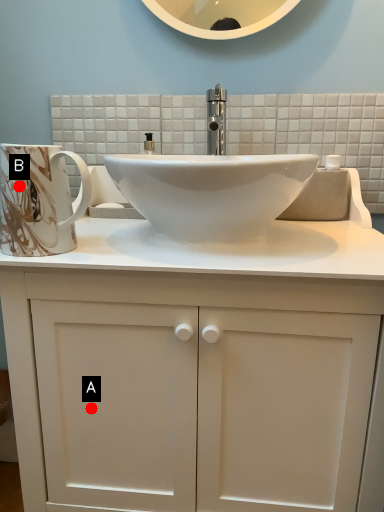
Question: Two points are circled on the image, labeled by A and B beside each circle. Among these points, which one is nearest to the camera?

Choices:
 (A) A is closer
 (B) B is closer

Answer: (B)